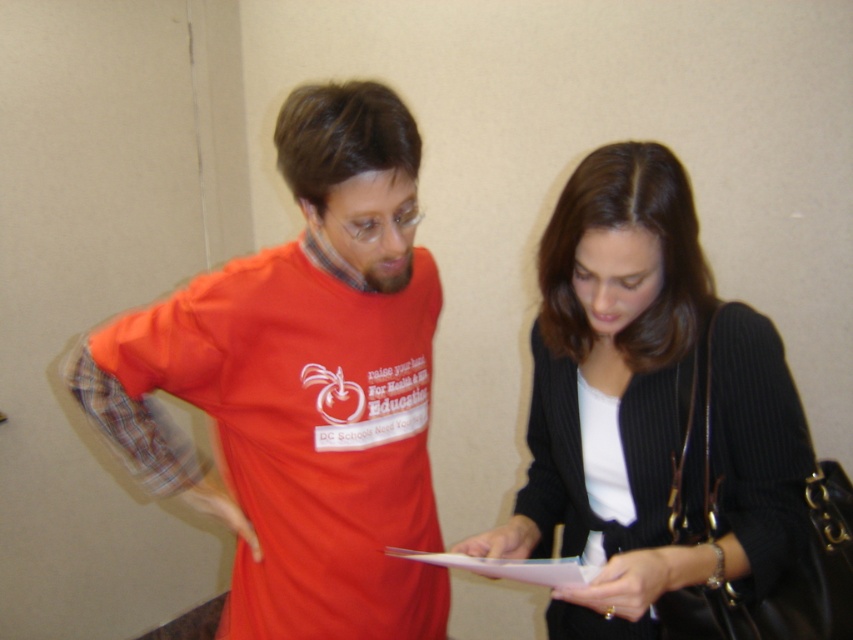
Question: Does matte red t-shirt at center appear on the right side of black ribbed sweater at center?

Choices:
 (A) no
 (B) yes

Answer: (A)

Question: Which point is farther to the camera?

Choices:
 (A) (717, 342)
 (B) (120, 388)

Answer: (B)

Question: Can you confirm if matte red t-shirt at center is positioned above black ribbed sweater at center?

Choices:
 (A) no
 (B) yes

Answer: (B)

Question: Which point is closer to the camera taking this photo?

Choices:
 (A) (585, 611)
 (B) (372, 451)

Answer: (B)

Question: Which of the following is the farthest from the observer?

Choices:
 (A) black ribbed sweater at center
 (B) matte red t-shirt at center

Answer: (A)

Question: Can you confirm if matte red t-shirt at center is bigger than black ribbed sweater at center?

Choices:
 (A) no
 (B) yes

Answer: (B)